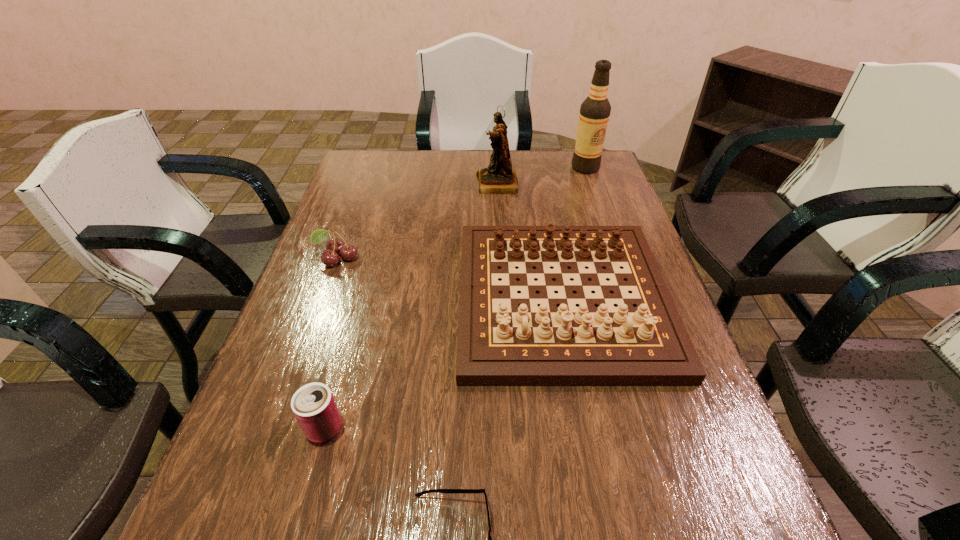
Locate an element on the screen. This screenshot has width=960, height=540. free location located 0.230m on the right of the second nearest object is located at coordinates (465, 428).

Where is `blank space located 0.140m on the leaves of the cherry`? blank space located 0.140m on the leaves of the cherry is located at coordinates (319, 309).

Image resolution: width=960 pixels, height=540 pixels. I want to click on alcohol at the far edge, so click(x=594, y=114).

What are the coordinates of `figurine positioned at the far edge` in the screenshot? It's located at (498, 178).

Find the location of a particular element. Image resolution: width=960 pixels, height=540 pixels. can that is positioned at the left edge is located at coordinates (313, 405).

This screenshot has width=960, height=540. What are the coordinates of `cherry present at the left edge` in the screenshot? It's located at (335, 246).

This screenshot has height=540, width=960. Find the location of `alcohol located in the right edge section of the desktop`. alcohol located in the right edge section of the desktop is located at coordinates [594, 114].

This screenshot has width=960, height=540. In order to click on gameboard located in the right edge section of the desktop in this screenshot , I will do `click(500, 343)`.

Where is `object present at the far right corner`? The height and width of the screenshot is (540, 960). object present at the far right corner is located at coordinates (594, 114).

Find the location of a particular element. Image resolution: width=960 pixels, height=540 pixels. free space at the far edge of the desktop is located at coordinates (476, 172).